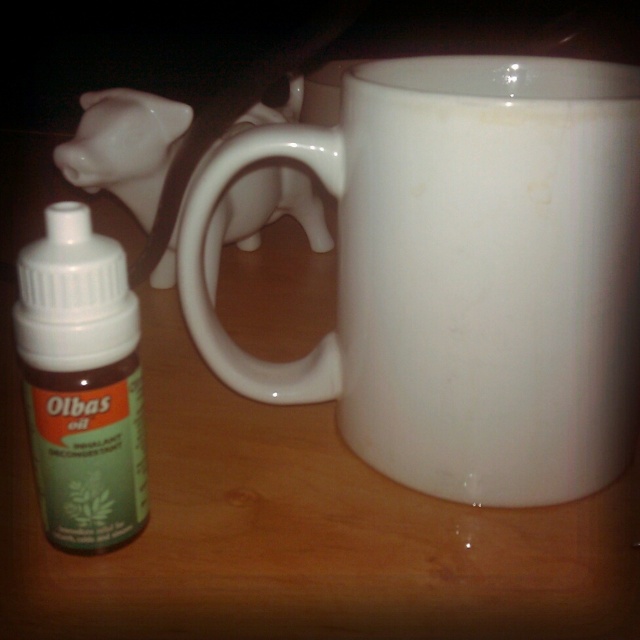
Does white glossy mug at center have a greater width compared to green matte bottle at left?

Yes.

Does white glossy mug at center have a lesser width compared to green matte bottle at left?

Incorrect, white glossy mug at center's width is not less than green matte bottle at left's.

Which is in front, point (486, 406) or point (141, 490)?

Positioned in front is point (141, 490).

I want to click on white glossy mug at center, so click(x=464, y=273).